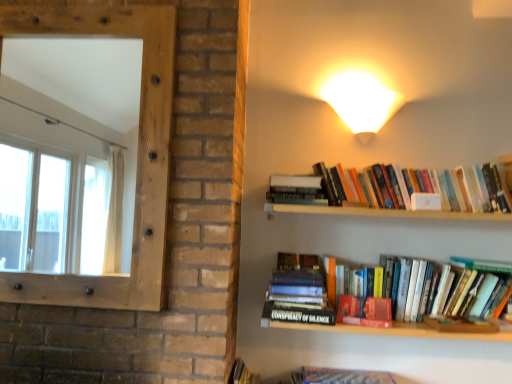
Question: Considering the relative positions of hardcover book at center, the second book viewed from the top, and matte red paperback book at center in the image provided, is hardcover book at center, the second book viewed from the top, behind matte red paperback book at center?

Choices:
 (A) no
 (B) yes

Answer: (A)

Question: Is hardcover book at center, the 1th book viewed from the left, positioned in front of matte red paperback book at center?

Choices:
 (A) no
 (B) yes

Answer: (B)

Question: Does hardcover book at center, acting as the 2th book starting from the right, have a greater width compared to matte red paperback book at center?

Choices:
 (A) no
 (B) yes

Answer: (B)

Question: Can you confirm if hardcover book at center, placed as the first book when sorted from bottom to top, is thinner than matte red paperback book at center?

Choices:
 (A) no
 (B) yes

Answer: (A)

Question: Is hardcover book at center, the second book viewed from the top, touching matte red paperback book at center?

Choices:
 (A) yes
 (B) no

Answer: (B)

Question: Is hardcover book at center, placed as the first book when sorted from bottom to top, oriented towards matte red paperback book at center?

Choices:
 (A) yes
 (B) no

Answer: (B)

Question: Can you confirm if matte red paperback book at center is bigger than white glossy wall sconce at upper right?

Choices:
 (A) yes
 (B) no

Answer: (B)

Question: From the image's perspective, is matte red paperback book at center on top of white glossy wall sconce at upper right?

Choices:
 (A) yes
 (B) no

Answer: (B)

Question: Is the position of matte red paperback book at center less distant than that of white glossy wall sconce at upper right?

Choices:
 (A) no
 (B) yes

Answer: (B)

Question: Does matte red paperback book at center have a greater height compared to white glossy wall sconce at upper right?

Choices:
 (A) no
 (B) yes

Answer: (A)

Question: Is matte red paperback book at center oriented towards white glossy wall sconce at upper right?

Choices:
 (A) yes
 (B) no

Answer: (B)

Question: Can you confirm if matte red paperback book at center is wider than white glossy wall sconce at upper right?

Choices:
 (A) yes
 (B) no

Answer: (B)

Question: From a real-world perspective, is natural wood frame at left under hardcover books at upper right, which appears as the first book when viewed from the right?

Choices:
 (A) yes
 (B) no

Answer: (B)